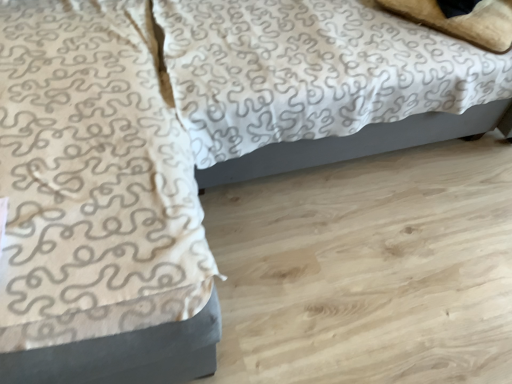
Question: Should I look upward or downward to see white textured blanket at upper left?

Choices:
 (A) up
 (B) down

Answer: (A)

Question: Is white textured blanket at upper left bigger than beige soft pillow at upper right?

Choices:
 (A) yes
 (B) no

Answer: (A)

Question: Is white textured blanket at upper left behind beige soft pillow at upper right?

Choices:
 (A) no
 (B) yes

Answer: (A)

Question: Is white textured blanket at upper left positioned in front of beige soft pillow at upper right?

Choices:
 (A) yes
 (B) no

Answer: (A)

Question: Is beige soft pillow at upper right inside white textured blanket at upper left?

Choices:
 (A) no
 (B) yes

Answer: (A)

Question: Is white textured blanket at upper left facing away from beige soft pillow at upper right?

Choices:
 (A) no
 (B) yes

Answer: (A)

Question: From a real-world perspective, is white textured blanket at upper left positioned over beige soft pillow at upper right based on gravity?

Choices:
 (A) yes
 (B) no

Answer: (B)

Question: From the image's perspective, is white textured fabric at center on white textured blanket at upper left?

Choices:
 (A) no
 (B) yes

Answer: (B)

Question: Is white textured fabric at center beside white textured blanket at upper left?

Choices:
 (A) no
 (B) yes

Answer: (A)

Question: Can you confirm if white textured fabric at center is bigger than white textured blanket at upper left?

Choices:
 (A) yes
 (B) no

Answer: (A)

Question: From a real-world perspective, is white textured fabric at center on white textured blanket at upper left?

Choices:
 (A) no
 (B) yes

Answer: (B)

Question: Does white textured fabric at center have a lesser width compared to white textured blanket at upper left?

Choices:
 (A) yes
 (B) no

Answer: (A)

Question: Does white textured fabric at center appear on the left side of white textured blanket at upper left?

Choices:
 (A) no
 (B) yes

Answer: (A)

Question: Can you confirm if beige soft pillow at upper right is shorter than white textured fabric at center?

Choices:
 (A) yes
 (B) no

Answer: (A)